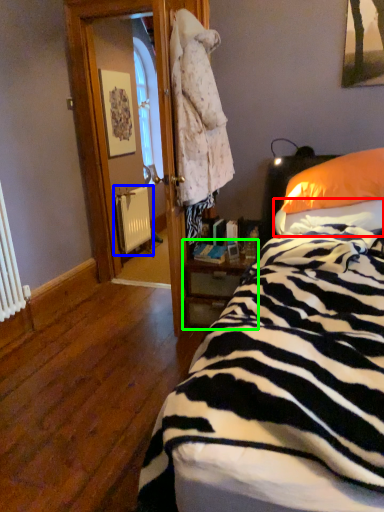
Question: Estimate the real-world distances between objects in this image. Which object is closer to sheet (highlighted by a red box), radiator (highlighted by a blue box) or nightstand (highlighted by a green box)?

Choices:
 (A) radiator
 (B) nightstand

Answer: (B)